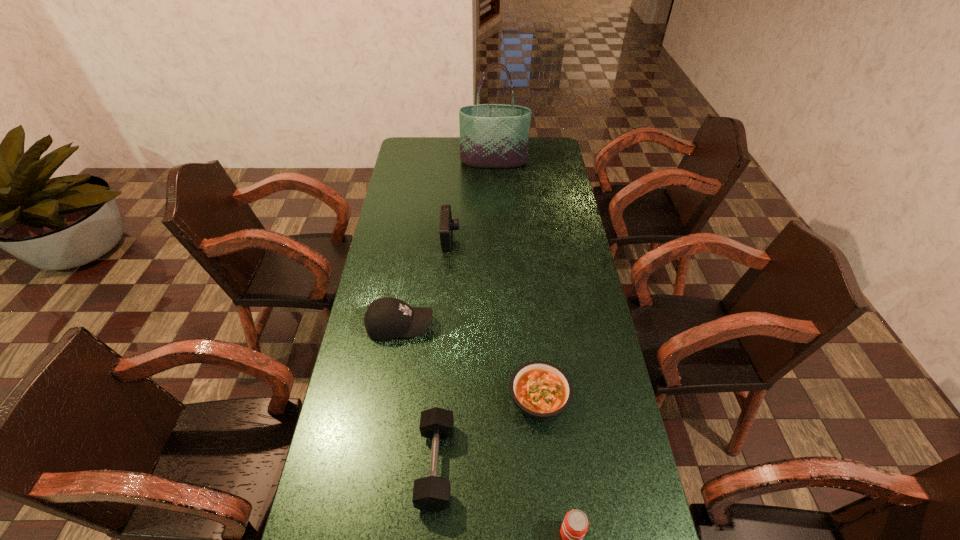
You are a GUI agent. You are given a task and a screenshot of the screen. Output one action in this format:
    pyautogui.click(x=<x>, y=<y>)
    Task: Click on the free spot located on the back of the stew
    Image resolution: width=960 pixels, height=540 pixels.
    Given the screenshot: What is the action you would take?
    pyautogui.click(x=527, y=282)

I want to click on object present at the far edge, so click(x=491, y=135).

Locate an element on the screen. The width and height of the screenshot is (960, 540). object positioned at the left edge is located at coordinates (387, 318).

Identify the location of object that is at the right edge. point(541,390).

Locate an element on the screen. free space at the far edge of the desktop is located at coordinates (446, 151).

Where is `free space at the left edge of the desktop`? The height and width of the screenshot is (540, 960). free space at the left edge of the desktop is located at coordinates click(x=400, y=228).

Identify the location of vacant area at the right edge of the desktop. This screenshot has width=960, height=540. (610, 379).

Find the location of `vacant space at the far left corner of the desktop`. vacant space at the far left corner of the desktop is located at coordinates (418, 152).

You are a GUI agent. You are given a task and a screenshot of the screen. Output one action in this format:
    pyautogui.click(x=<x>, y=<y>)
    Task: Click on the vacant space at the far right corner of the desktop
    
    Given the screenshot: What is the action you would take?
    pyautogui.click(x=531, y=153)

Find the location of a particular element. The image size is (960, 540). vacant space in between the fifth nearest object and the stew is located at coordinates (494, 319).